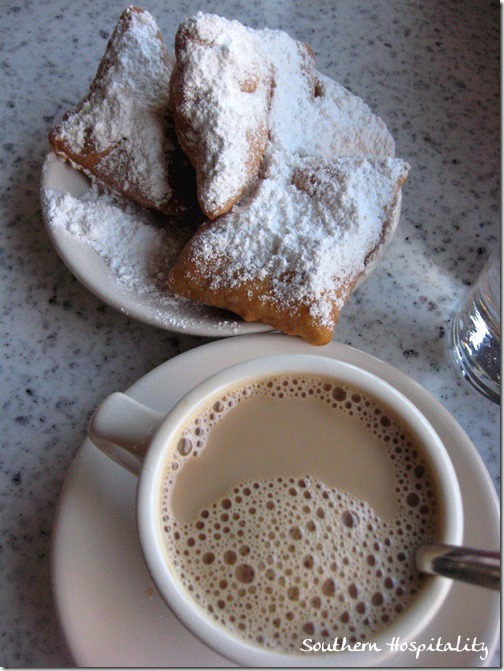
I want to click on handle, so click(x=112, y=415).